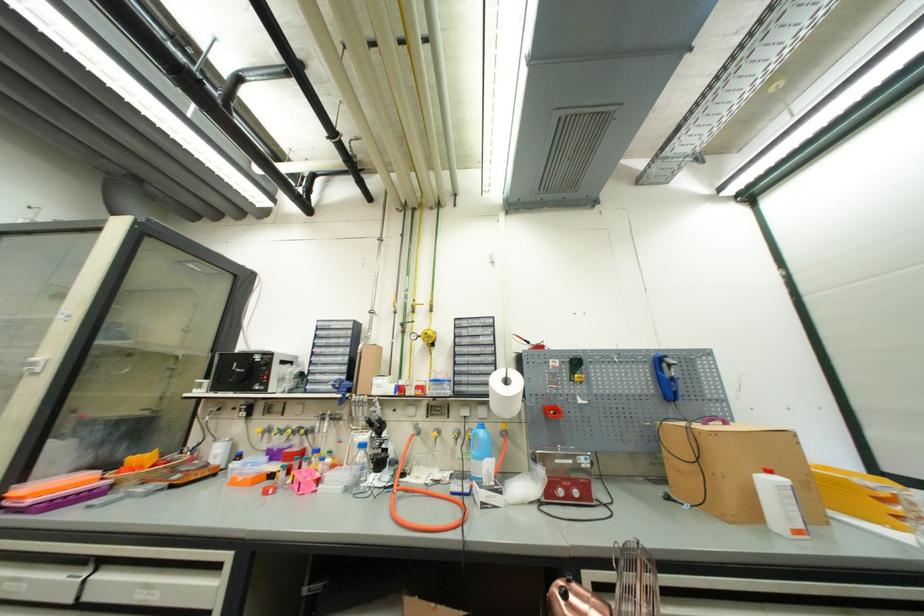
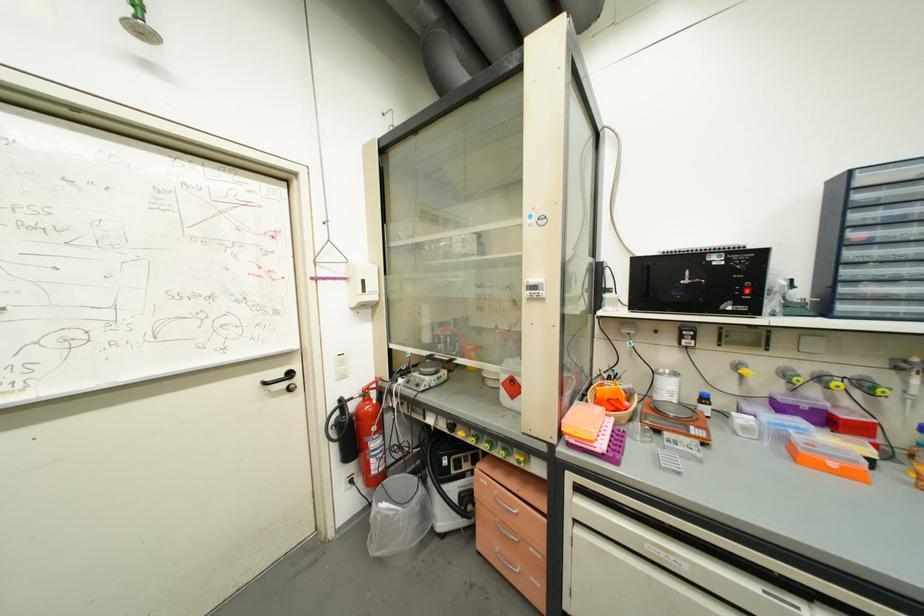
Find the pixel in the second image that matches point 86,578 in the first image.

(803, 610)